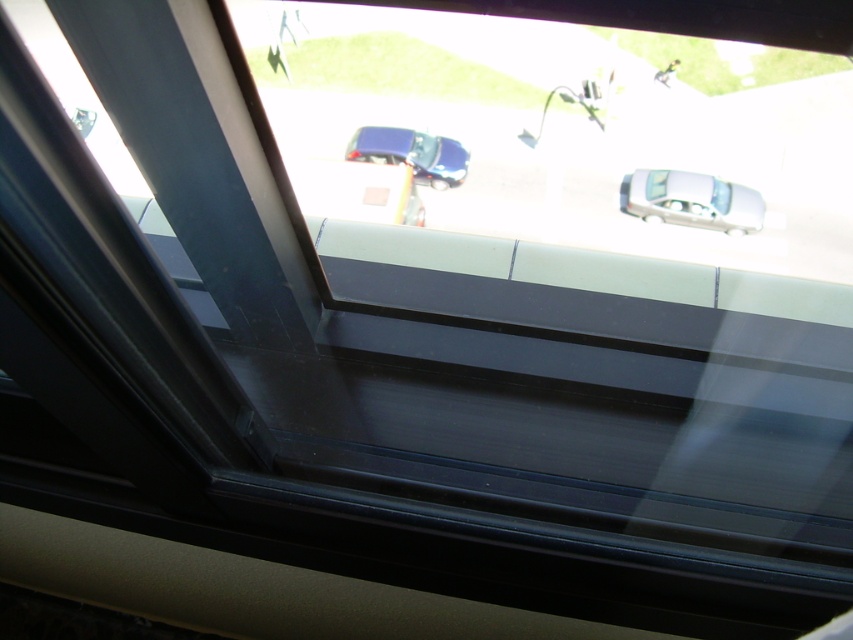
Question: Is white glossy car at center positioned behind shiny blue car at center?

Choices:
 (A) no
 (B) yes

Answer: (A)

Question: Does white glossy car at center appear over shiny blue car at center?

Choices:
 (A) yes
 (B) no

Answer: (B)

Question: Does white glossy car at center have a lesser width compared to shiny blue car at center?

Choices:
 (A) no
 (B) yes

Answer: (A)